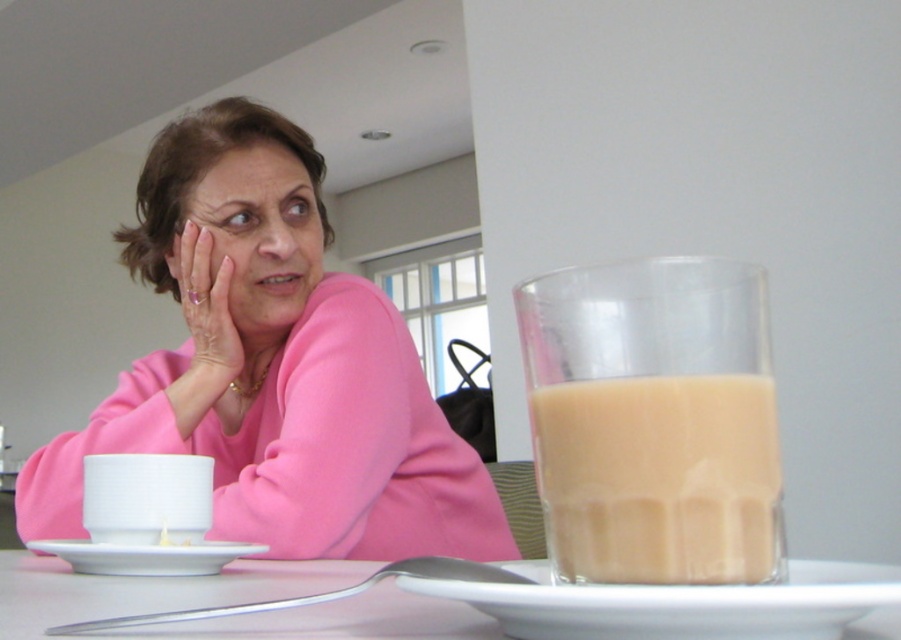
You are a waiter in a cafe and need to place a dessert plate on the table without knocking over the translucent glass at right. Where should you place the dessert plate relative to the white glossy saucer at lower left?

The translucent glass at right is located above the white glossy saucer at lower left, so placing the dessert plate near the white glossy saucer at lower left would keep it away from the glass and prevent it from tipping over.

You are a waiter in a cafe and need to place a new order of a salad on the table. The salad should be placed on the white ceramic plate at center. However, the plate is currently occupied by a glass of tea. Can you place the salad on the plate without moving the glass?

The white ceramic plate at center is currently occupied by a glass of tea, so you cannot place the salad on it without moving the glass.

You are a server at a cafe and need to place a new order of cookies on the table. The cookies require 12 inches of space to fit. Can you place them on the table near the white ceramic plate at center?

The white ceramic plate at center is 12.21 inches away from the viewer, so there is enough space to place the cookies near it since the required space is 12 inches.